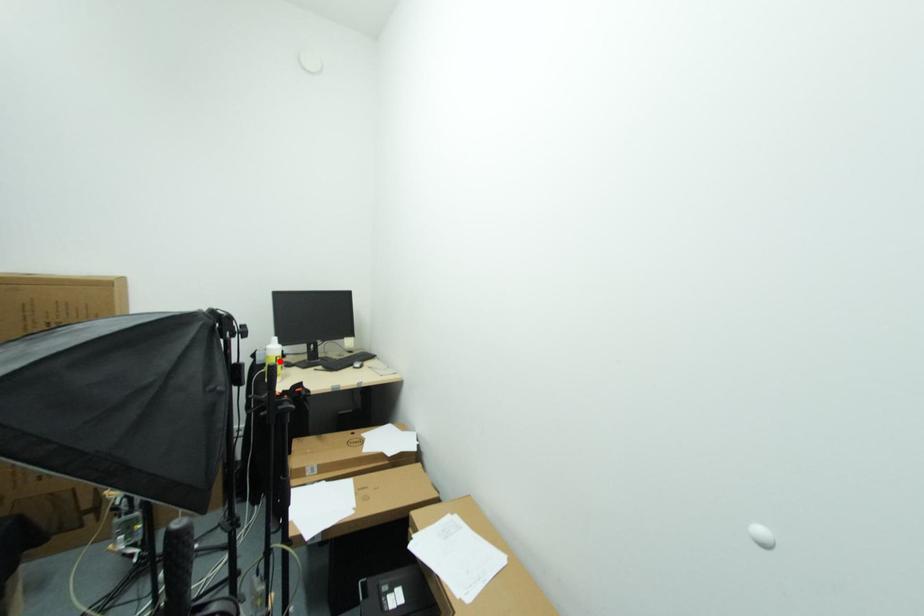
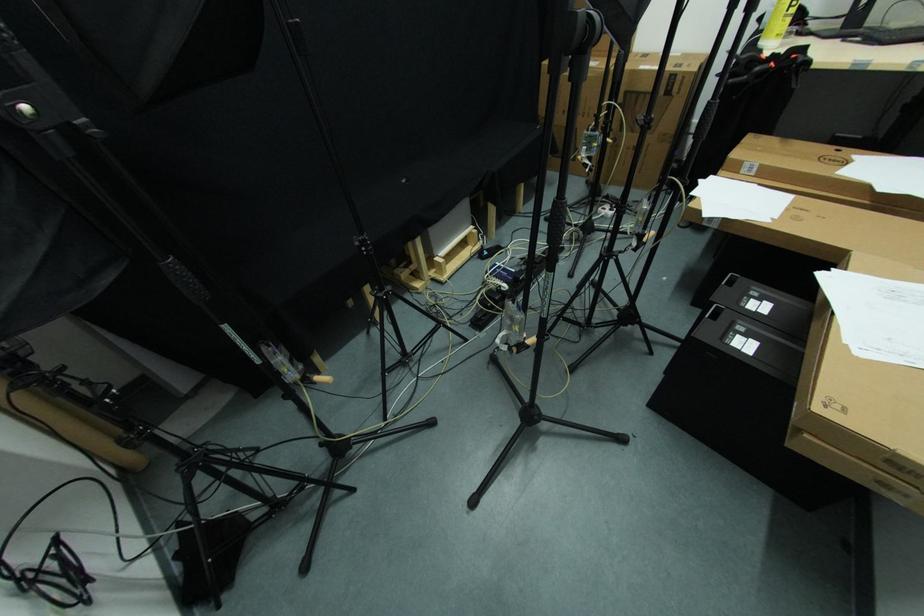
Question: I am providing you with two images of the same scene from different viewpoints. Given a red point in image1, look at the same physical point in image2. Is it:

Choices:
 (A) Closer to the viewpoint
 (B) Farther from the viewpoint

Answer: (B)